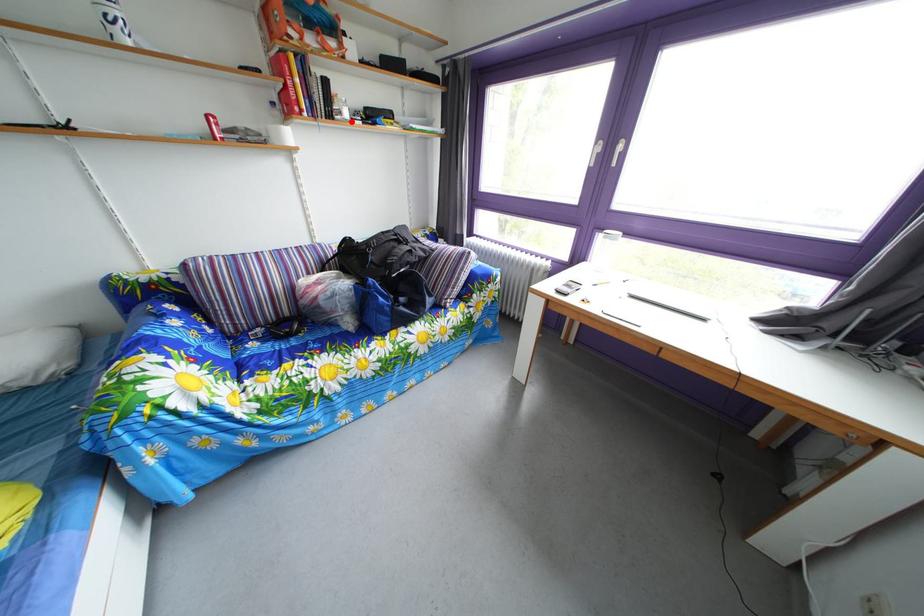
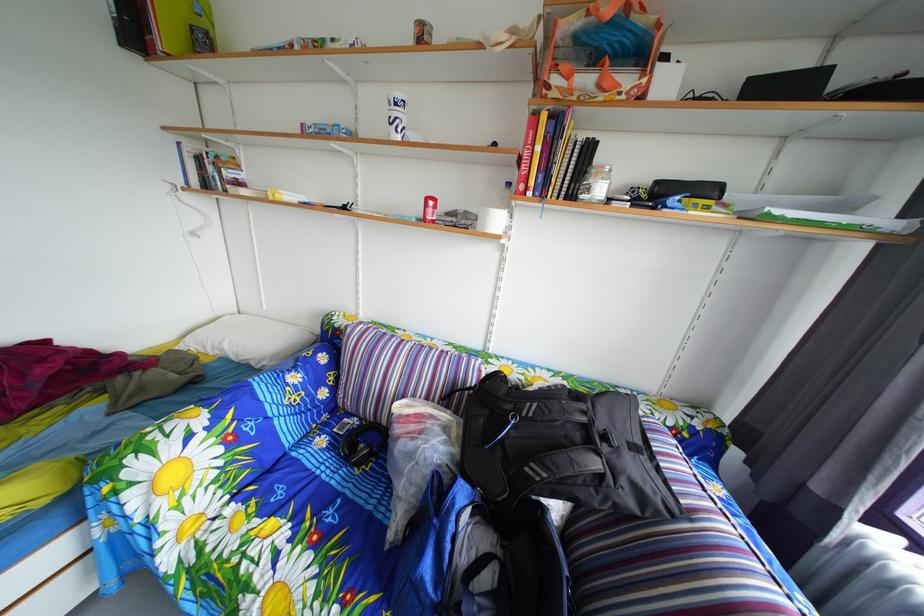
Where in the second image is the point corresponding to the highlighted location from the first image?

(600, 198)